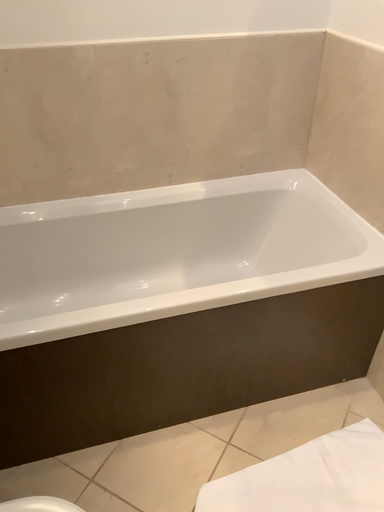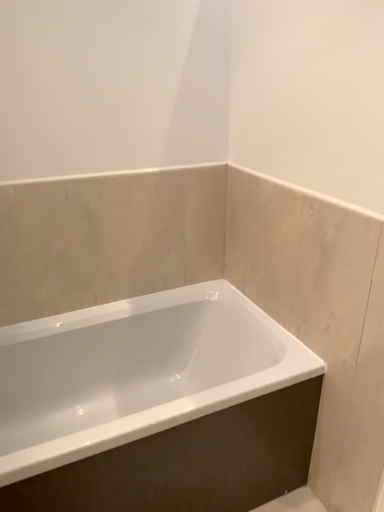
Question: Which way did the camera rotate in the video?

Choices:
 (A) rotated left
 (B) rotated right

Answer: (B)